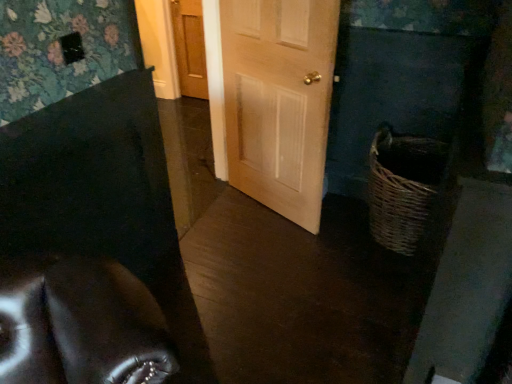
Describe the element at coordinates (402, 187) in the screenshot. This screenshot has height=384, width=512. I see `woven brown basket at lower right` at that location.

Find the location of a particular element. wooden door at center, which is counted as the first door, starting from the left is located at coordinates (190, 47).

Locate an element on the screen. The width and height of the screenshot is (512, 384). woven brown basket at lower right is located at coordinates (402, 187).

Is light wood door at center, which is the second door from left to right, facing away from woven brown basket at lower right?

No, light wood door at center, which is the second door from left to right, is not facing away from woven brown basket at lower right.

From a real-world perspective, relative to woven brown basket at lower right, is light wood door at center, which is the second door from left to right, vertically above or below?

From a real-world perspective, light wood door at center, which is the second door from left to right, is physically above woven brown basket at lower right.

In the scene shown: Does light wood door at center, which is counted as the 1th door, starting from the right, appear on the right side of woven brown basket at lower right?

In fact, light wood door at center, which is counted as the 1th door, starting from the right, is to the left of woven brown basket at lower right.

Does light wood door at center, which is the 1th door from front to back, lie in front of woven brown basket at lower right?

That is True.

The width and height of the screenshot is (512, 384). There is a woven brown basket at lower right. Identify the location of the 1st door above it (from a real-world perspective). (190, 47).

From a real-world perspective, is woven brown basket at lower right physically located above or below wooden door at center, the second door when ordered from bottom to top?

Clearly, from a real-world perspective, woven brown basket at lower right is below wooden door at center, the second door when ordered from bottom to top.

Consider the image. Is woven brown basket at lower right inside the boundaries of wooden door at center, which is counted as the first door, starting from the left, or outside?

woven brown basket at lower right is not inside wooden door at center, which is counted as the first door, starting from the left, it's outside.

Does woven brown basket at lower right have a greater height compared to wooden door at center, the first door viewed from the top?

Incorrect, the height of woven brown basket at lower right is not larger of that of wooden door at center, the first door viewed from the top.

From a real-world perspective, is woven brown basket at lower right located higher than light wood door at center, which is counted as the first door, starting from the bottom?

No, from a real-world perspective, woven brown basket at lower right is not over light wood door at center, which is counted as the first door, starting from the bottom

Considering the positions of point (426, 187) and point (296, 199), is point (426, 187) closer or farther from the camera than point (296, 199)?

Point (426, 187).

This screenshot has width=512, height=384. I want to click on basket that appears behind the light wood door at center, which is counted as the first door, starting from the bottom, so click(x=402, y=187).

Does woven brown basket at lower right turn towards light wood door at center, which is counted as the 1th door, starting from the right?

No.

Considering the relative positions of wooden door at center, the second door when ordered from bottom to top, and light wood door at center, which is the 1th door from front to back, in the image provided, is wooden door at center, the second door when ordered from bottom to top, to the left or to the right of light wood door at center, which is the 1th door from front to back,?

In the image, wooden door at center, the second door when ordered from bottom to top, appears on the left side of light wood door at center, which is the 1th door from front to back.

In the scene shown: Which is behind, wooden door at center, the second door positioned from the right, or light wood door at center, which is the 1th door from front to back?

wooden door at center, the second door positioned from the right, is further from the camera.

Where is `door below the light wood door at center, the 2th door positioned from the top (from a real-world perspective)`? door below the light wood door at center, the 2th door positioned from the top (from a real-world perspective) is located at coordinates tap(190, 47).

From their relative heights in the image, would you say wooden door at center, positioned as the second door in front-to-back order, is taller or shorter than light wood door at center, the 2th door positioned from the top?

wooden door at center, positioned as the second door in front-to-back order, is shorter than light wood door at center, the 2th door positioned from the top.

Does light wood door at center, which is the 1th door from front to back, appear on the left side of wooden door at center, the first door when ordered from back to front?

Incorrect, light wood door at center, which is the 1th door from front to back, is not on the left side of wooden door at center, the first door when ordered from back to front.

Does light wood door at center, which is the second door from left to right, have a smaller size compared to wooden door at center, which is counted as the first door, starting from the left?

Actually, light wood door at center, which is the second door from left to right, might be larger than wooden door at center, which is counted as the first door, starting from the left.

Does light wood door at center, the 2th door positioned from the top, turn towards wooden door at center, the first door viewed from the top?

No, light wood door at center, the 2th door positioned from the top, is not oriented towards wooden door at center, the first door viewed from the top.

Is light wood door at center, which is the second door from left to right, in front of or behind wooden door at center, the first door when ordered from back to front, in the image?

Clearly, light wood door at center, which is the second door from left to right, is in front of wooden door at center, the first door when ordered from back to front.

Considering the sizes of wooden door at center, the first door when ordered from back to front, and woven brown basket at lower right in the image, is wooden door at center, the first door when ordered from back to front, bigger or smaller than woven brown basket at lower right?

wooden door at center, the first door when ordered from back to front, is smaller than woven brown basket at lower right.

Looking at this image, from their relative heights in the image, would you say wooden door at center, positioned as the second door in front-to-back order, is taller or shorter than woven brown basket at lower right?

In the image, wooden door at center, positioned as the second door in front-to-back order, appears to be taller than woven brown basket at lower right.

From the image's perspective, is wooden door at center, the second door positioned from the right, below woven brown basket at lower right?

No.

Is wooden door at center, the second door when ordered from bottom to top, facing away from woven brown basket at lower right?

No, woven brown basket at lower right is not at the back of wooden door at center, the second door when ordered from bottom to top.

At what (x,y) coordinates should I click in order to perform the action: click on basket below the light wood door at center, which is the 1th door from front to back (from the image's perspective). Please return your answer as a coordinate pair (x, y). Looking at the image, I should click on (402, 187).

Locate an element on the screen. Image resolution: width=512 pixels, height=384 pixels. the 1st door positioned above the woven brown basket at lower right (from a real-world perspective) is located at coordinates (190, 47).

Considering their positions, is light wood door at center, which appears as the 2th door when viewed from the back, positioned further to wooden door at center, the second door positioned from the right, than woven brown basket at lower right?

woven brown basket at lower right is positioned further to the anchor wooden door at center, the second door positioned from the right.

Based on their spatial positions, is light wood door at center, which appears as the 2th door when viewed from the back, or wooden door at center, positioned as the second door in front-to-back order, further from woven brown basket at lower right?

Based on the image, wooden door at center, positioned as the second door in front-to-back order, appears to be further to woven brown basket at lower right.

Based on their spatial positions, is woven brown basket at lower right or light wood door at center, which is counted as the 1th door, starting from the right, closer to wooden door at center, the second door when ordered from bottom to top?

Among the two, light wood door at center, which is counted as the 1th door, starting from the right, is located nearer to wooden door at center, the second door when ordered from bottom to top.

Estimate the real-world distances between objects in this image. Which object is closer to light wood door at center, the 2th door positioned from the top, woven brown basket at lower right or wooden door at center, the second door when ordered from bottom to top?

The object closer to light wood door at center, the 2th door positioned from the top, is woven brown basket at lower right.

Estimate the real-world distances between objects in this image. Which object is further from woven brown basket at lower right, wooden door at center, the second door when ordered from bottom to top, or light wood door at center, which is the 1th door from front to back?

wooden door at center, the second door when ordered from bottom to top, is positioned further to the anchor woven brown basket at lower right.

Looking at the image, which one is located closer to light wood door at center, which is counted as the first door, starting from the bottom, wooden door at center, the first door when ordered from back to front, or woven brown basket at lower right?

Among the two, woven brown basket at lower right is located nearer to light wood door at center, which is counted as the first door, starting from the bottom.

Find the location of a particular element. basket between light wood door at center, which is the 1th door from front to back, and wooden door at center, which is counted as the first door, starting from the left, from front to back is located at coordinates (402, 187).